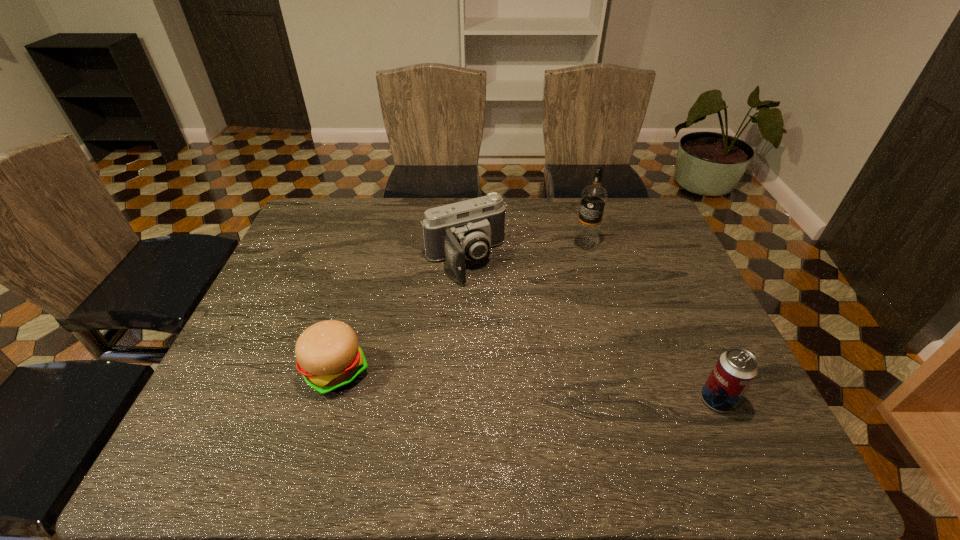
Find the location of a particular element. vacant spot on the desktop that is between the hamburger and the rightmost object and is positioned on the label of the tallest object is located at coordinates (471, 381).

At what (x,y) coordinates should I click in order to perform the action: click on vacant spot on the desktop that is between the hamburger and the beer can and is positioned at the front of the third object from right to left with an open lens cover. Please return your answer as a coordinate pair (x, y). Image resolution: width=960 pixels, height=540 pixels. Looking at the image, I should click on (546, 387).